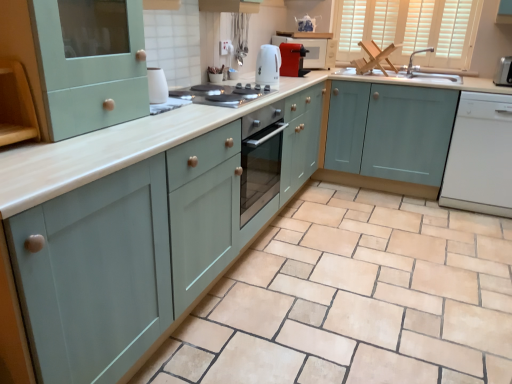
Question: In terms of width, does white glossy electric kettle at center, the third appliance viewed from the back, look wider or thinner when compared to white glossy dishwasher at right?

Choices:
 (A) thin
 (B) wide

Answer: (A)

Question: Looking at the image, does white glossy electric kettle at center, the third appliance viewed from the back, seem bigger or smaller compared to white glossy dishwasher at right?

Choices:
 (A) small
 (B) big

Answer: (A)

Question: Which object is the closest to the matte silver faucet at upper right?

Choices:
 (A) white wood window at upper right
 (B) matte teal cabinet at center, the second cabinetry positioned from the right
 (C) satin silver toaster at upper right, the 3th appliance positioned from the front
 (D) matte red toaster at upper center, which appears as the 4th appliance when viewed from the front
 (E) light blue wood cabinet at center, which is counted as the first cabinetry, starting from the right

Answer: (A)

Question: Which object is the farthest from the white glossy paper towel holder at upper center, the 1th appliance positioned from the left?

Choices:
 (A) satin silver toaster at upper right, marked as the first appliance in a right-to-left arrangement
 (B) white glossy electric kettle at center, placed as the third appliance when sorted from right to left
 (C) matte red microwave at upper center
 (D) white glossy dishwasher at right
 (E) white wood window at upper right

Answer: (A)